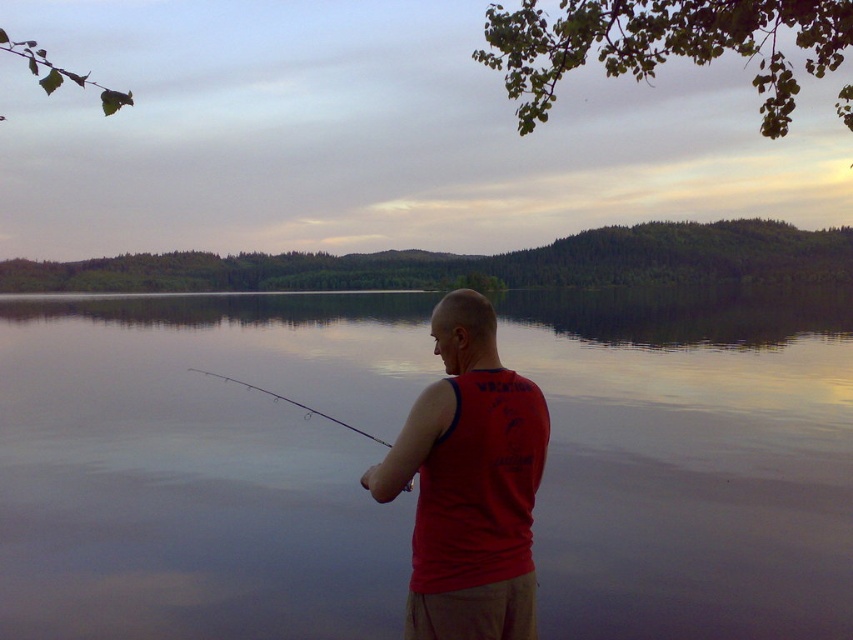
Does smooth water at center have a lesser width compared to red matte tank top at center?

No.

Can you confirm if smooth water at center is positioned above red matte tank top at center?

Yes.

Who is more forward, (x=331, y=468) or (x=465, y=460)?

Positioned in front is point (x=465, y=460).

Locate an element on the screen. The image size is (853, 640). smooth water at center is located at coordinates (202, 465).